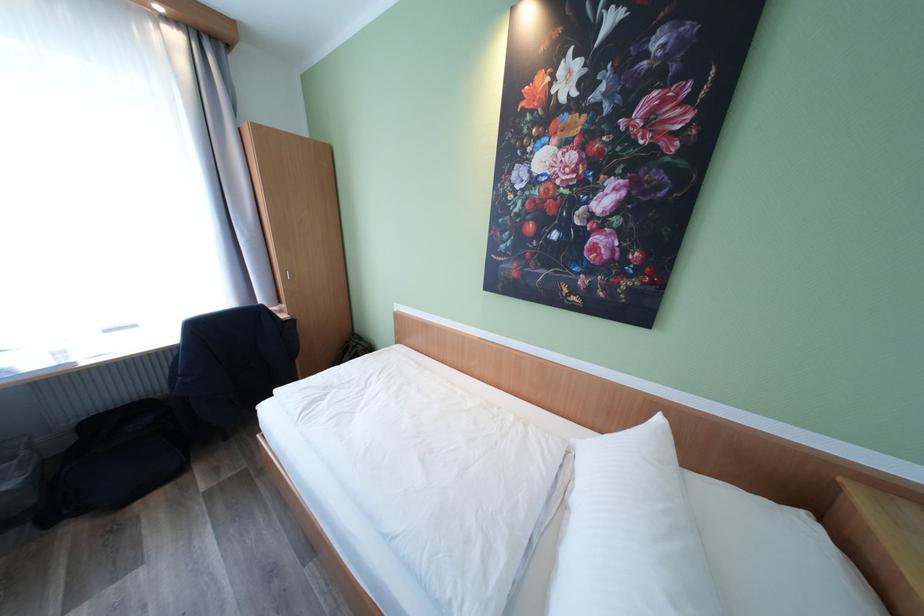
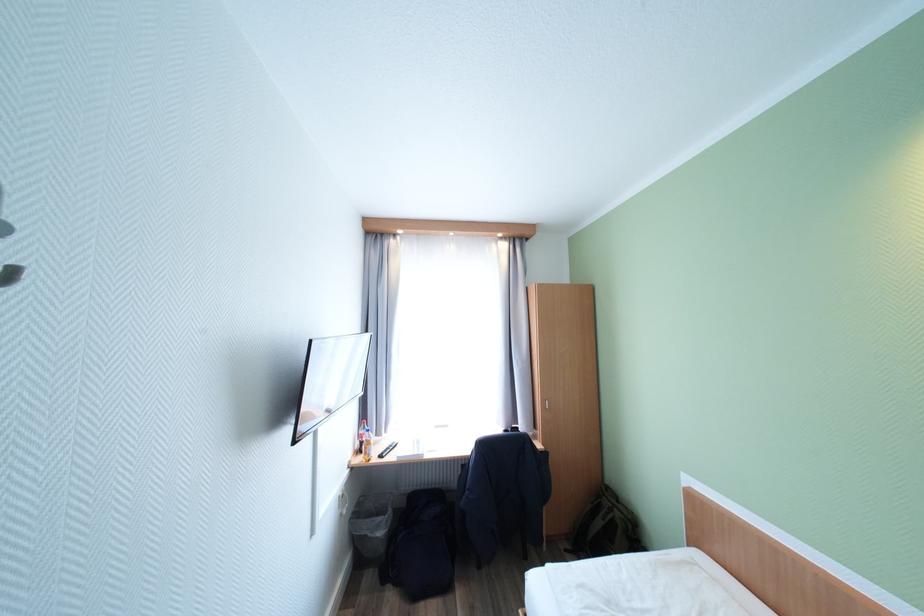
The point at (40,501) is marked in the first image. Where is the corresponding point in the second image?

(390, 551)